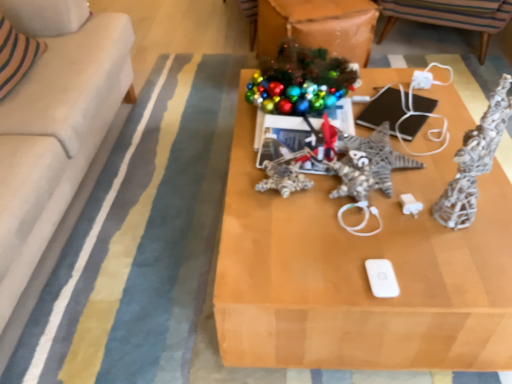
Question: Can you confirm if white matte ipod at center is positioned to the right of wooden table at center?

Choices:
 (A) no
 (B) yes

Answer: (A)

Question: Considering the relative sizes of white matte ipod at center and wooden table at center in the image provided, is white matte ipod at center bigger than wooden table at center?

Choices:
 (A) yes
 (B) no

Answer: (B)

Question: From the image's perspective, is white matte ipod at center located above wooden table at center?

Choices:
 (A) yes
 (B) no

Answer: (B)

Question: Does white matte ipod at center lie in front of wooden table at center?

Choices:
 (A) yes
 (B) no

Answer: (B)

Question: Is white matte ipod at center aimed at wooden table at center?

Choices:
 (A) yes
 (B) no

Answer: (B)

Question: Considering the positions of striped fabric chair at upper center and white fabric couch at left in the image, is striped fabric chair at upper center bigger or smaller than white fabric couch at left?

Choices:
 (A) small
 (B) big

Answer: (A)

Question: From their relative heights in the image, would you say striped fabric chair at upper center is taller or shorter than white fabric couch at left?

Choices:
 (A) tall
 (B) short

Answer: (B)

Question: Looking at their shapes, would you say striped fabric chair at upper center is wider or thinner than white fabric couch at left?

Choices:
 (A) thin
 (B) wide

Answer: (A)

Question: Considering the positions of point (474, 13) and point (44, 104), is point (474, 13) closer or farther from the camera than point (44, 104)?

Choices:
 (A) closer
 (B) farther

Answer: (B)

Question: In the image, is wooden table at center positioned in front of or behind white fabric couch at left?

Choices:
 (A) front
 (B) behind

Answer: (B)

Question: Based on their sizes in the image, would you say wooden table at center is bigger or smaller than white fabric couch at left?

Choices:
 (A) small
 (B) big

Answer: (A)

Question: Would you say wooden table at center is inside or outside white fabric couch at left?

Choices:
 (A) inside
 (B) outside

Answer: (B)

Question: From a real-world perspective, is wooden table at center positioned above or below white fabric couch at left?

Choices:
 (A) above
 (B) below

Answer: (B)

Question: Does point (130, 72) appear closer or farther from the camera than point (394, 296)?

Choices:
 (A) farther
 (B) closer

Answer: (A)

Question: From a real-world perspective, is white fabric couch at left positioned above or below white matte ipod at center?

Choices:
 (A) below
 (B) above

Answer: (B)